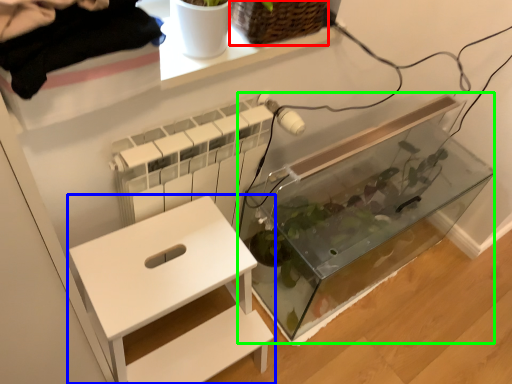
Question: Considering the real-world distances, which object is closest to basket (highlighted by a red box)? furniture (highlighted by a blue box) or glass box (highlighted by a green box).

Choices:
 (A) furniture
 (B) glass box

Answer: (A)